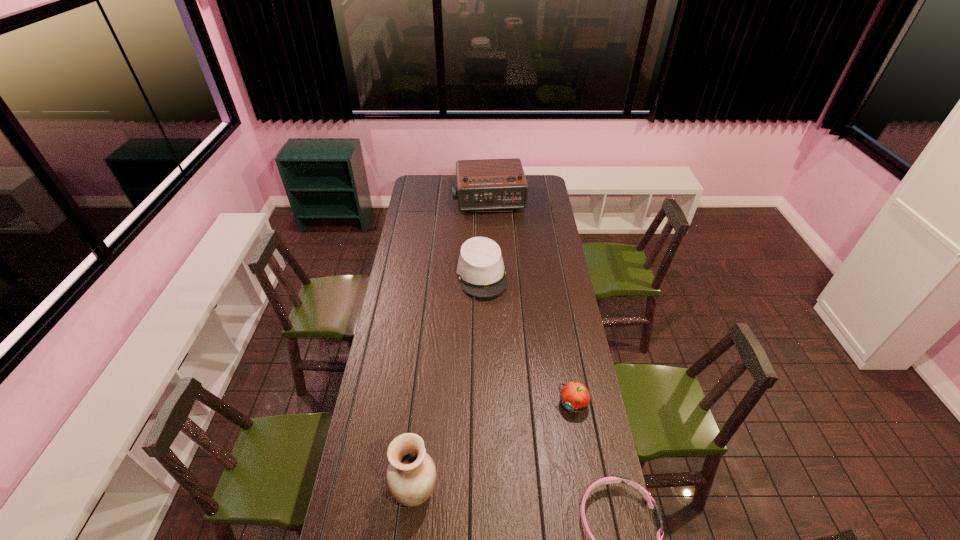
The width and height of the screenshot is (960, 540). In order to click on free spot located on the tuning display of the farthest object in this screenshot , I will do `click(495, 238)`.

You are a GUI agent. You are given a task and a screenshot of the screen. Output one action in this format:
    pyautogui.click(x=<x>, y=<y>)
    Task: Click on the free space located 0.300m on the tuning display of the farthest object
    The height and width of the screenshot is (540, 960).
    Given the screenshot: What is the action you would take?
    pyautogui.click(x=497, y=248)

Identify the location of vacant space located 0.300m on the surface of the apple. This screenshot has height=540, width=960. (521, 478).

Image resolution: width=960 pixels, height=540 pixels. I want to click on vacant region located on the surface of the apple, so click(x=537, y=455).

What are the coordinates of `vacant space situated on the surface of the apple` in the screenshot? It's located at (521, 478).

This screenshot has width=960, height=540. Identify the location of object at the far edge. (488, 184).

Where is `object located in the near edge section of the desktop`? The image size is (960, 540). object located in the near edge section of the desktop is located at coordinates (411, 474).

Identify the location of object present at the left edge. (411, 474).

You are a GUI agent. You are given a task and a screenshot of the screen. Output one action in this format:
    pyautogui.click(x=<x>, y=<y>)
    Task: Click on the object that is at the right edge
    
    Given the screenshot: What is the action you would take?
    pyautogui.click(x=574, y=396)

The height and width of the screenshot is (540, 960). Identify the location of object located at the near left corner. (411, 474).